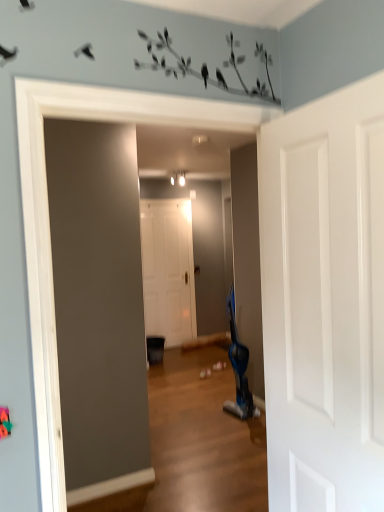
Question: From a real-world perspective, is white matte door at center, which ranks as the 2th door in front-to-back order, on top of blue plastic swivel chair at center-right?

Choices:
 (A) yes
 (B) no

Answer: (A)

Question: Considering the relative positions of white matte door at center, which is counted as the 1th door, starting from the back, and blue plastic swivel chair at center-right in the image provided, is white matte door at center, which is counted as the 1th door, starting from the back, to the left of blue plastic swivel chair at center-right from the viewer's perspective?

Choices:
 (A) no
 (B) yes

Answer: (B)

Question: Is white matte door at center, which is counted as the 1th door, starting from the back, directly adjacent to blue plastic swivel chair at center-right?

Choices:
 (A) yes
 (B) no

Answer: (B)

Question: From a real-world perspective, is white matte door at center, which is counted as the 1th door, starting from the back, beneath blue plastic swivel chair at center-right?

Choices:
 (A) yes
 (B) no

Answer: (B)

Question: Is white matte door at center, which is counted as the 1th door, starting from the back, aimed at blue plastic swivel chair at center-right?

Choices:
 (A) no
 (B) yes

Answer: (B)

Question: From a real-world perspective, is blue plastic swivel chair at center-right positioned above or below white matte door at center, which is the 1th door in left-to-right order?

Choices:
 (A) below
 (B) above

Answer: (A)

Question: In terms of height, does blue plastic swivel chair at center-right look taller or shorter compared to white matte door at center, which is counted as the 1th door, starting from the back?

Choices:
 (A) short
 (B) tall

Answer: (A)

Question: Considering the positions of point click(246, 355) and point click(185, 289), is point click(246, 355) closer or farther from the camera than point click(185, 289)?

Choices:
 (A) farther
 (B) closer

Answer: (B)

Question: Considering the positions of blue plastic swivel chair at center-right and white matte door at center, which is the 1th door in left-to-right order, in the image, is blue plastic swivel chair at center-right bigger or smaller than white matte door at center, which is the 1th door in left-to-right order,?

Choices:
 (A) small
 (B) big

Answer: (A)

Question: Do you think blue plastic swivel chair at center-right is within white glossy door at upper right, positioned as the second door in left-to-right order, or outside of it?

Choices:
 (A) inside
 (B) outside

Answer: (B)

Question: Is point (241, 408) positioned closer to the camera than point (329, 390)?

Choices:
 (A) closer
 (B) farther

Answer: (B)

Question: From their relative heights in the image, would you say blue plastic swivel chair at center-right is taller or shorter than white glossy door at upper right, marked as the first door in a right-to-left arrangement?

Choices:
 (A) short
 (B) tall

Answer: (A)

Question: Based on their positions, is blue plastic swivel chair at center-right located to the left or right of white glossy door at upper right, marked as the first door in a right-to-left arrangement?

Choices:
 (A) left
 (B) right

Answer: (B)

Question: Looking at the image, does white glossy door at upper right, positioned as the second door in left-to-right order, seem bigger or smaller compared to white matte door at center, which is counted as the 1th door, starting from the back?

Choices:
 (A) big
 (B) small

Answer: (B)

Question: Visually, is white glossy door at upper right, which ranks as the second door in back-to-front order, positioned to the left or to the right of white matte door at center, which ranks as the 2th door in front-to-back order?

Choices:
 (A) right
 (B) left

Answer: (A)